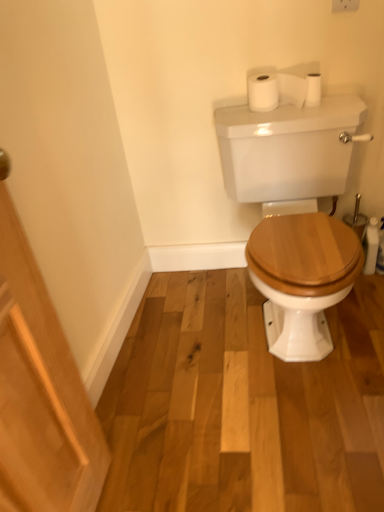
Image resolution: width=384 pixels, height=512 pixels. In order to click on unoccupied area in front of white glossy porcelain at center in this screenshot , I will do `click(281, 437)`.